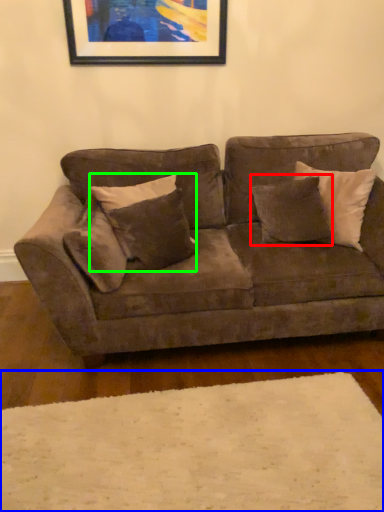
Question: Which object is the closest to the pillow (highlighted by a red box)? Choose among these: plain (highlighted by a blue box) or pillow (highlighted by a green box).

Choices:
 (A) plain
 (B) pillow

Answer: (B)